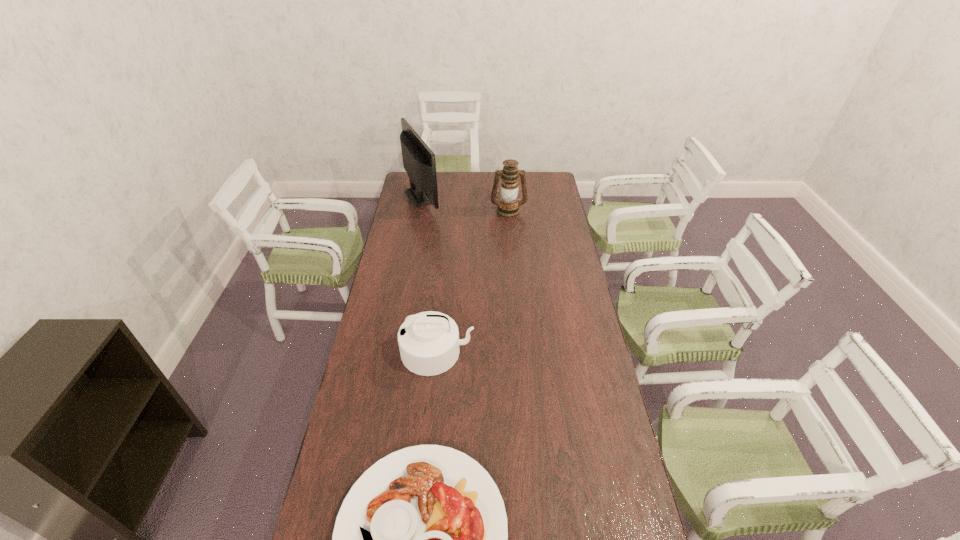
This screenshot has height=540, width=960. I want to click on empty space that is in between the third tallest object and the third shortest object, so click(x=473, y=281).

Identify which object is the second closest to the second nearest object. Please provide its 2D coordinates. Your answer should be formatted as a tuple, i.e. [(x, y)], where the tuple contains the x and y coordinates of a point satisfying the conditions above.

[(419, 162)]

Identify which object is located as the second nearest to the lantern. Please provide its 2D coordinates. Your answer should be formatted as a tuple, i.e. [(x, y)], where the tuple contains the x and y coordinates of a point satisfying the conditions above.

[(429, 342)]

The height and width of the screenshot is (540, 960). In order to click on free region that satisfies the following two spatial constraints: 1. on the front-facing side of the tallest object; 2. on the left side of the second tallest object in this screenshot , I will do `click(420, 211)`.

Locate an element on the screen. vacant space that satisfies the following two spatial constraints: 1. on the back side of the lantern; 2. on the front-facing side of the tallest object is located at coordinates (507, 196).